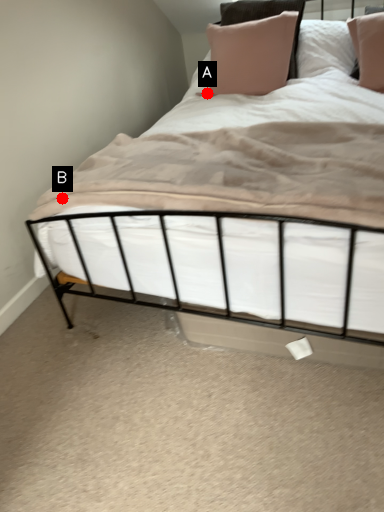
Question: Two points are circled on the image, labeled by A and B beside each circle. Among these points, which one is farthest from the camera?

Choices:
 (A) A is further
 (B) B is further

Answer: (A)